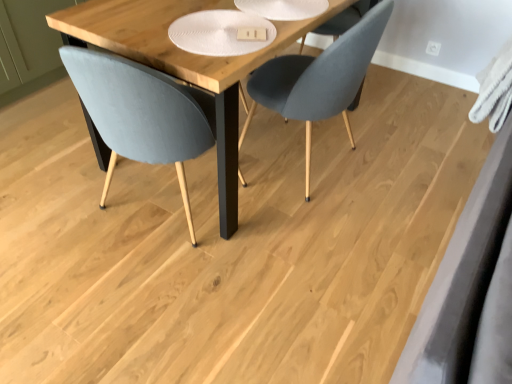
Find the location of a particular element. The width and height of the screenshot is (512, 384). free location in front of velvet grey chair at center, the first chair in the right-to-left sequence is located at coordinates (322, 244).